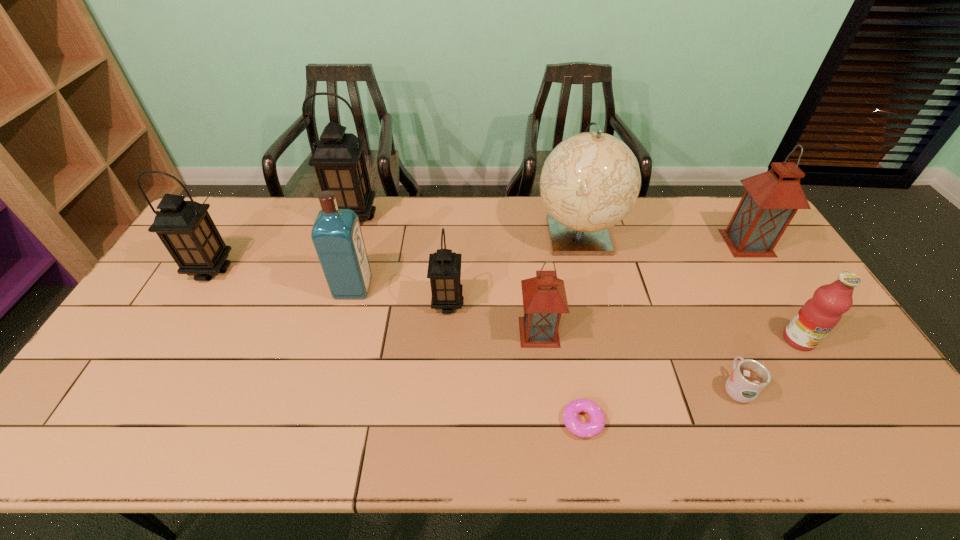
You are a GUI agent. You are given a task and a screenshot of the screen. Output one action in this format:
    pyautogui.click(x=<x>, y=<y>)
    Task: Click on the free space that is in between the shortest object and the fruit juice
    
    Given the screenshot: What is the action you would take?
    pyautogui.click(x=691, y=381)

Where is `empty location between the liquor and the globe`? This screenshot has width=960, height=540. empty location between the liquor and the globe is located at coordinates (466, 260).

Where is `empty location between the seventh object from right to left and the globe`? This screenshot has width=960, height=540. empty location between the seventh object from right to left and the globe is located at coordinates [x=513, y=268].

Where is `vacant point located between the doughnut and the beige globe`? The width and height of the screenshot is (960, 540). vacant point located between the doughnut and the beige globe is located at coordinates (581, 327).

The width and height of the screenshot is (960, 540). In order to click on free area in between the smaller pink lantern and the shortest object in this screenshot , I will do `click(561, 376)`.

The height and width of the screenshot is (540, 960). Identify the location of free space between the seventh object from right to left and the pink doughnut. (516, 362).

The height and width of the screenshot is (540, 960). I want to click on the eighth closest object to the pink doughnut, so click(338, 158).

I want to click on object that can be found as the third closest to the leftmost lantern, so click(x=444, y=268).

Select which lantern is the fourth closest to the liquor. Please provide its 2D coordinates. Your answer should be formatted as a tuple, i.e. [(x, y)], where the tuple contains the x and y coordinates of a point satisfying the conditions above.

[(544, 298)]

Where is `lantern that is the fifth closest one to the pink doughnut`? lantern that is the fifth closest one to the pink doughnut is located at coordinates (186, 229).